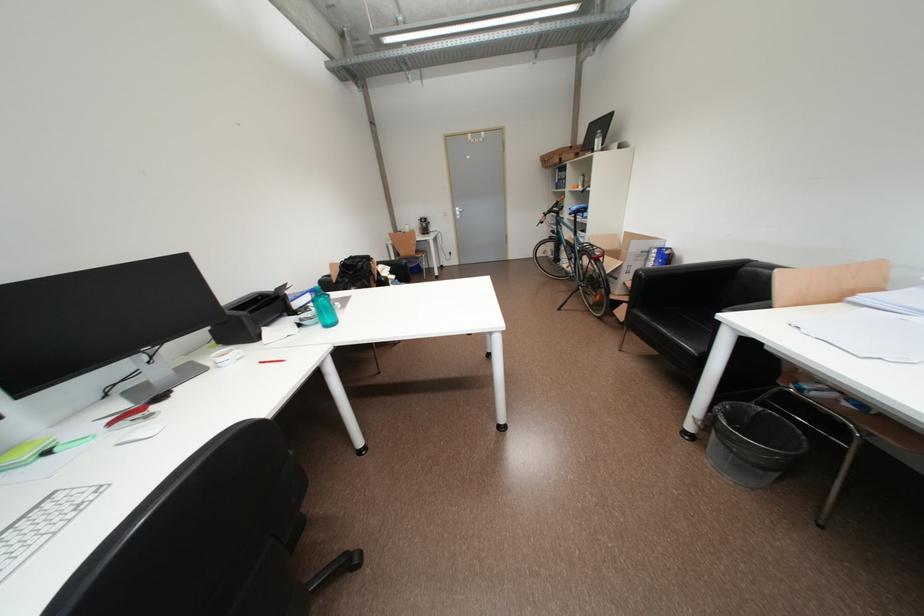
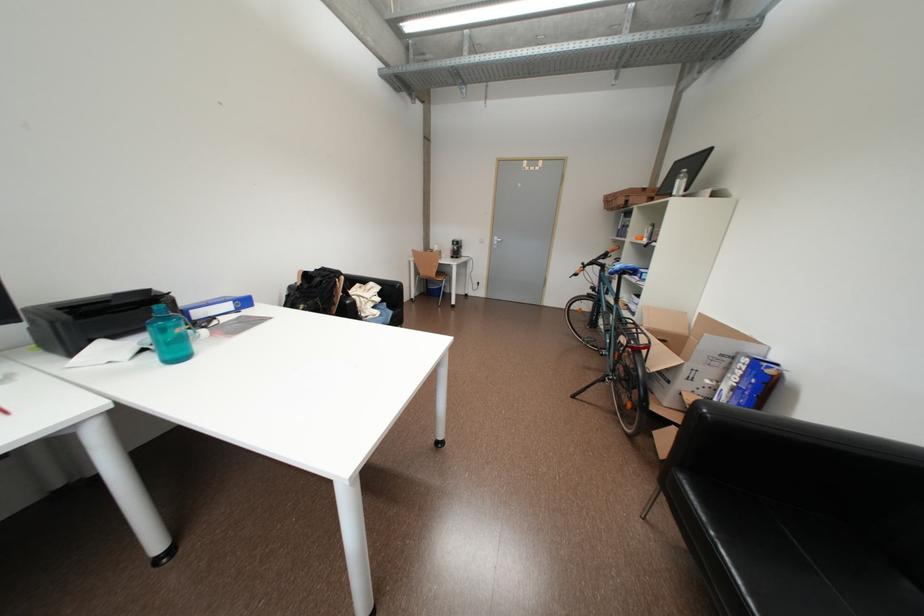
Question: Based on the continuous images, in which direction is the camera rotating? Reply with the corresponding letter.

Choices:
 (A) Left
 (B) Right
 (C) Up
 (D) Down

Answer: (A)